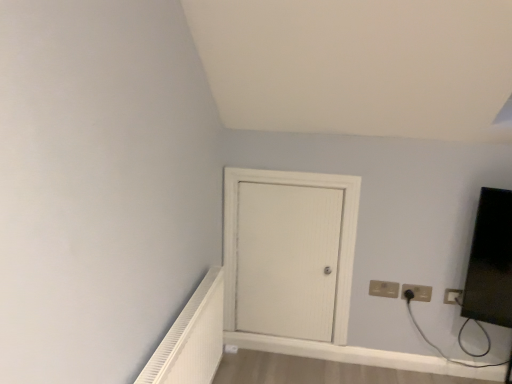
What is the approximate height of white textured radiator at lower left?

It is 21.14 inches.

The height and width of the screenshot is (384, 512). What do you see at coordinates (453, 296) in the screenshot?
I see `white plastic electric outlet at upper right, marked as the 1th electric outlet in a right-to-left arrangement` at bounding box center [453, 296].

I want to click on white textured radiator at lower left, so click(191, 338).

Considering the sizes of white plastic electric outlet at upper right, marked as the 1th electric outlet in a right-to-left arrangement, and matte black outlet at upper right, which is the second electric outlet in left-to-right order, in the image, is white plastic electric outlet at upper right, marked as the 1th electric outlet in a right-to-left arrangement, wider or thinner than matte black outlet at upper right, which is the second electric outlet in left-to-right order,?

Considering their sizes, white plastic electric outlet at upper right, marked as the 1th electric outlet in a right-to-left arrangement, looks slimmer than matte black outlet at upper right, which is the second electric outlet in left-to-right order.

From the image's perspective, between white plastic electric outlet at upper right, marked as the 1th electric outlet in a right-to-left arrangement, and matte black outlet at upper right, which is the second electric outlet in left-to-right order, which one is located above?

From the image's view, matte black outlet at upper right, which is the second electric outlet in left-to-right order, is above.

Can you tell me how much white plastic electric outlet at upper right, the third electric outlet when ordered from left to right, and matte black outlet at upper right, the 2th electric outlet positioned from the right, differ in facing direction?

There is a 0.493-degree angle between the facing directions of white plastic electric outlet at upper right, the third electric outlet when ordered from left to right, and matte black outlet at upper right, the 2th electric outlet positioned from the right.

Who is smaller, white textured radiator at lower left or white wood door at center?

white wood door at center is smaller.

Is white textured radiator at lower left shorter than white wood door at center?

Correct, white textured radiator at lower left is not as tall as white wood door at center.

Does white textured radiator at lower left appear on the left side of white wood door at center?

Correct, you'll find white textured radiator at lower left to the left of white wood door at center.

From the image's perspective, who appears lower, white textured radiator at lower left or white wood door at center?

From the image's view, white textured radiator at lower left is below.

From the image's perspective, which is below, white textured radiator at lower left or beige plastic electric outlet at lower right, placed as the 1th electric outlet when sorted from left to right?

From the image's view, white textured radiator at lower left is below.

Between point (207, 344) and point (377, 290), which one is positioned behind?

The point (377, 290) is more distant.

Can we say white textured radiator at lower left lies outside beige plastic electric outlet at lower right, placed as the 1th electric outlet when sorted from left to right?

Yes, white textured radiator at lower left is located beyond the bounds of beige plastic electric outlet at lower right, placed as the 1th electric outlet when sorted from left to right.

From the image's perspective, is white plastic electric outlet at upper right, marked as the 1th electric outlet in a right-to-left arrangement, above or below white textured radiator at lower left?

Clearly, from the image's perspective, white plastic electric outlet at upper right, marked as the 1th electric outlet in a right-to-left arrangement, is above white textured radiator at lower left.

Who is bigger, white plastic electric outlet at upper right, marked as the 1th electric outlet in a right-to-left arrangement, or white textured radiator at lower left?

white textured radiator at lower left is bigger.

Is white plastic electric outlet at upper right, marked as the 1th electric outlet in a right-to-left arrangement, spatially inside white textured radiator at lower left, or outside of it?

white plastic electric outlet at upper right, marked as the 1th electric outlet in a right-to-left arrangement, exists outside the volume of white textured radiator at lower left.

Is white wood door at center looking in the opposite direction of matte black outlet at upper right, the 2th electric outlet positioned from the right?

white wood door at center does not have its back to matte black outlet at upper right, the 2th electric outlet positioned from the right.

Can you confirm if white wood door at center is thinner than matte black outlet at upper right, which is the second electric outlet in left-to-right order?

No.

Does point (320, 274) lie in front of point (416, 288)?

No, it is behind (416, 288).

From a real-world perspective, between white wood door at center and beige plastic electric outlet at lower right, the third electric outlet positioned from the right, who is vertically higher?

In real-world perspective, white wood door at center is above.

Considering the relative sizes of white wood door at center and beige plastic electric outlet at lower right, placed as the 1th electric outlet when sorted from left to right, in the image provided, is white wood door at center smaller than beige plastic electric outlet at lower right, placed as the 1th electric outlet when sorted from left to right,?

Incorrect, white wood door at center is not smaller in size than beige plastic electric outlet at lower right, placed as the 1th electric outlet when sorted from left to right.

Is point (349, 214) positioned after point (371, 289)?

No, (349, 214) is closer to viewer.

Between white wood door at center and beige plastic electric outlet at lower right, the third electric outlet positioned from the right, which one appears on the right side from the viewer's perspective?

Positioned to the right is beige plastic electric outlet at lower right, the third electric outlet positioned from the right.

From the image's perspective, who appears lower, beige plastic electric outlet at lower right, placed as the 1th electric outlet when sorted from left to right, or white textured radiator at lower left?

white textured radiator at lower left is shown below in the image.

Is beige plastic electric outlet at lower right, the third electric outlet positioned from the right, oriented towards white textured radiator at lower left?

No, beige plastic electric outlet at lower right, the third electric outlet positioned from the right, does not turn towards white textured radiator at lower left.

Is beige plastic electric outlet at lower right, placed as the 1th electric outlet when sorted from left to right, further to camera compared to white textured radiator at lower left?

Yes, it is.

Would you say beige plastic electric outlet at lower right, placed as the 1th electric outlet when sorted from left to right, is outside white textured radiator at lower left?

Absolutely, beige plastic electric outlet at lower right, placed as the 1th electric outlet when sorted from left to right, is external to white textured radiator at lower left.

From the image's perspective, which electric outlet is the 1st one above the white plastic electric outlet at upper right, marked as the 1th electric outlet in a right-to-left arrangement? Please provide its 2D coordinates.

[(417, 292)]

The image size is (512, 384). I want to click on radiator below the white wood door at center (from the image's perspective), so click(191, 338).

In the scene shown: Considering their positions, is white textured radiator at lower left positioned closer to white plastic electric outlet at upper right, the third electric outlet when ordered from left to right, than matte black outlet at upper right, which is the second electric outlet in left-to-right order?

Among the two, matte black outlet at upper right, which is the second electric outlet in left-to-right order, is located nearer to white plastic electric outlet at upper right, the third electric outlet when ordered from left to right.

Estimate the real-world distances between objects in this image. Which object is further from white textured radiator at lower left, white plastic electric outlet at upper right, marked as the 1th electric outlet in a right-to-left arrangement, or matte black outlet at upper right, the 2th electric outlet positioned from the right?

The object further to white textured radiator at lower left is white plastic electric outlet at upper right, marked as the 1th electric outlet in a right-to-left arrangement.

Estimate the real-world distances between objects in this image. Which object is closer to matte black outlet at upper right, the 2th electric outlet positioned from the right, white wood door at center or beige plastic electric outlet at lower right, the third electric outlet positioned from the right?

Among the two, beige plastic electric outlet at lower right, the third electric outlet positioned from the right, is located nearer to matte black outlet at upper right, the 2th electric outlet positioned from the right.

Looking at the image, which one is located further to white plastic electric outlet at upper right, the third electric outlet when ordered from left to right, matte black outlet at upper right, the 2th electric outlet positioned from the right, or beige plastic electric outlet at lower right, the third electric outlet positioned from the right?

beige plastic electric outlet at lower right, the third electric outlet positioned from the right, is positioned further to the anchor white plastic electric outlet at upper right, the third electric outlet when ordered from left to right.

Estimate the real-world distances between objects in this image. Which object is closer to white textured radiator at lower left, white wood door at center or matte black outlet at upper right, which is the second electric outlet in left-to-right order?

white wood door at center is positioned closer to the anchor white textured radiator at lower left.

When comparing their distances from beige plastic electric outlet at lower right, the third electric outlet positioned from the right, does white wood door at center or white textured radiator at lower left seem closer?

The object closer to beige plastic electric outlet at lower right, the third electric outlet positioned from the right, is white wood door at center.

When comparing their distances from white plastic electric outlet at upper right, the third electric outlet when ordered from left to right, does matte black outlet at upper right, which is the second electric outlet in left-to-right order, or white wood door at center seem further?

white wood door at center lies further to white plastic electric outlet at upper right, the third electric outlet when ordered from left to right, than the other object.

Looking at the image, which one is located closer to white plastic electric outlet at upper right, the third electric outlet when ordered from left to right, white wood door at center or matte black outlet at upper right, the 2th electric outlet positioned from the right?

matte black outlet at upper right, the 2th electric outlet positioned from the right, lies closer to white plastic electric outlet at upper right, the third electric outlet when ordered from left to right, than the other object.

The height and width of the screenshot is (384, 512). Find the location of `electric outlet between beige plastic electric outlet at lower right, the third electric outlet positioned from the right, and white plastic electric outlet at upper right, marked as the 1th electric outlet in a right-to-left arrangement, in the horizontal direction`. electric outlet between beige plastic electric outlet at lower right, the third electric outlet positioned from the right, and white plastic electric outlet at upper right, marked as the 1th electric outlet in a right-to-left arrangement, in the horizontal direction is located at coordinates (417, 292).

Where is `door positioned between white textured radiator at lower left and matte black outlet at upper right, the 2th electric outlet positioned from the right, from near to far`? door positioned between white textured radiator at lower left and matte black outlet at upper right, the 2th electric outlet positioned from the right, from near to far is located at coordinates (289, 253).

Where is `door between white textured radiator at lower left and beige plastic electric outlet at lower right, placed as the 1th electric outlet when sorted from left to right, along the z-axis`? Image resolution: width=512 pixels, height=384 pixels. door between white textured radiator at lower left and beige plastic electric outlet at lower right, placed as the 1th electric outlet when sorted from left to right, along the z-axis is located at coordinates (289, 253).

The image size is (512, 384). I want to click on electric outlet between white wood door at center and matte black outlet at upper right, which is the second electric outlet in left-to-right order, so click(x=384, y=289).